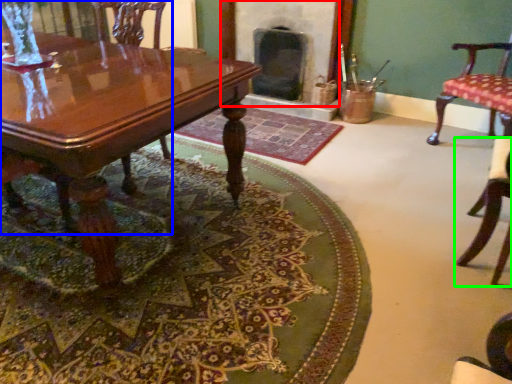
Question: Based on their relative distances, which object is nearer to fireplace (highlighted by a red box)? Choose from chair (highlighted by a blue box) and chair (highlighted by a green box).

Choices:
 (A) chair
 (B) chair

Answer: (B)